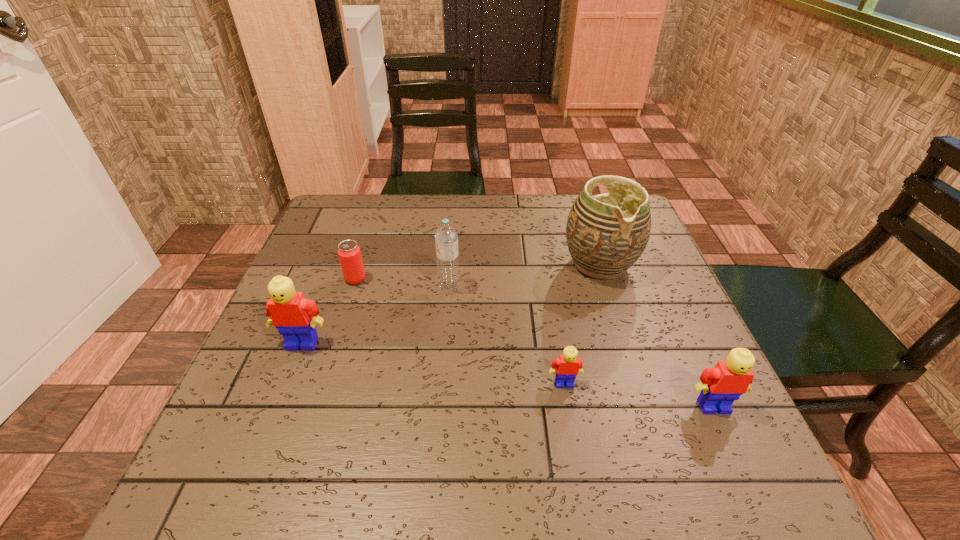
The image size is (960, 540). I want to click on the farthest Lego, so click(x=295, y=317).

Locate an element on the screen. the fourth farthest object is located at coordinates (295, 317).

Identify the location of the second nearest object. Image resolution: width=960 pixels, height=540 pixels. (567, 367).

At what (x,y) coordinates should I click in order to perform the action: click on the third object from right to left. Please return your answer as a coordinate pair (x, y). Image resolution: width=960 pixels, height=540 pixels. Looking at the image, I should click on (567, 367).

I want to click on the rightmost Lego, so click(722, 385).

Image resolution: width=960 pixels, height=540 pixels. I want to click on the fourth tallest object, so click(x=722, y=385).

Identify the location of the fourth object from right to left. Image resolution: width=960 pixels, height=540 pixels. (446, 236).

The height and width of the screenshot is (540, 960). In order to click on pottery in this screenshot , I will do `click(606, 234)`.

You are a GUI agent. You are given a task and a screenshot of the screen. Output one action in this format:
    pyautogui.click(x=<x>, y=<y>)
    Task: Click on the beer can
    
    Given the screenshot: What is the action you would take?
    pyautogui.click(x=349, y=253)

At what (x,y) coordinates should I click in order to perform the action: click on vacant region located on the front-facing side of the fourth farthest object. Please return your answer as a coordinate pair (x, y). Looking at the image, I should click on (273, 418).